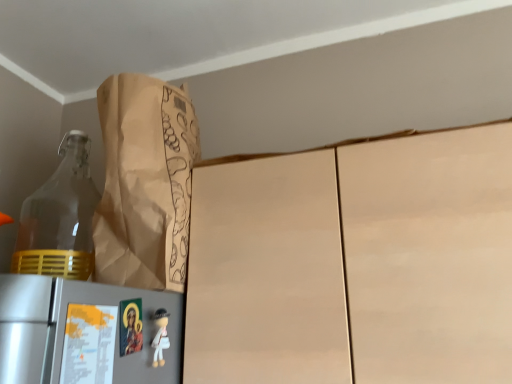
In order to click on metallic silver fridge at lower left in this screenshot , I will do `click(85, 332)`.

The height and width of the screenshot is (384, 512). Describe the element at coordinates (85, 332) in the screenshot. I see `metallic silver fridge at lower left` at that location.

Locate an element on the screen. Image resolution: width=512 pixels, height=384 pixels. metallic silver fridge at lower left is located at coordinates (85, 332).